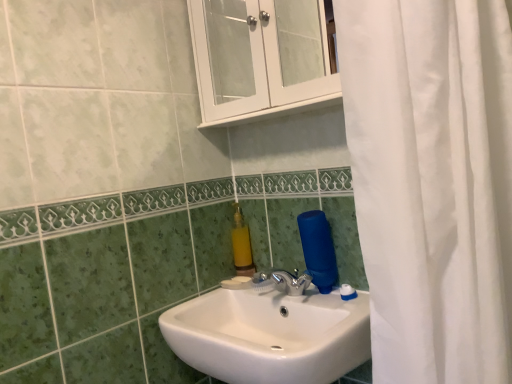
Question: Is the depth of white glossy cabinet at upper center less than that of white glossy sink at center?

Choices:
 (A) yes
 (B) no

Answer: (B)

Question: Can you confirm if white glossy cabinet at upper center is bigger than white glossy sink at center?

Choices:
 (A) no
 (B) yes

Answer: (A)

Question: Is white glossy cabinet at upper center outside white glossy sink at center?

Choices:
 (A) no
 (B) yes

Answer: (B)

Question: Does white glossy cabinet at upper center have a smaller size compared to white glossy sink at center?

Choices:
 (A) no
 (B) yes

Answer: (B)

Question: From the image's perspective, is white glossy cabinet at upper center on top of white glossy sink at center?

Choices:
 (A) yes
 (B) no

Answer: (A)

Question: Considering the positions of white glossy sink at center and yellow matte soap dispenser at upper center in the image, is white glossy sink at center wider or thinner than yellow matte soap dispenser at upper center?

Choices:
 (A) wide
 (B) thin

Answer: (A)

Question: Would you say white glossy sink at center is inside or outside yellow matte soap dispenser at upper center?

Choices:
 (A) outside
 (B) inside

Answer: (A)

Question: Considering their positions, is white glossy sink at center located in front of or behind yellow matte soap dispenser at upper center?

Choices:
 (A) front
 (B) behind

Answer: (A)

Question: In the image, is white glossy sink at center on the left side or the right side of yellow matte soap dispenser at upper center?

Choices:
 (A) left
 (B) right

Answer: (B)

Question: Is yellow matte soap dispenser at upper center bigger or smaller than white glossy sink at center?

Choices:
 (A) big
 (B) small

Answer: (B)

Question: From the image's perspective, is yellow matte soap dispenser at upper center above or below white glossy sink at center?

Choices:
 (A) below
 (B) above

Answer: (B)

Question: From a real-world perspective, is yellow matte soap dispenser at upper center physically located above or below white glossy sink at center?

Choices:
 (A) below
 (B) above

Answer: (B)

Question: Does point (251, 254) appear closer or farther from the camera than point (227, 288)?

Choices:
 (A) farther
 (B) closer

Answer: (A)

Question: Is yellow matte soap dispenser at upper center wider or thinner than white glossy cabinet at upper center?

Choices:
 (A) wide
 (B) thin

Answer: (B)

Question: From the image's perspective, is yellow matte soap dispenser at upper center above or below white glossy cabinet at upper center?

Choices:
 (A) above
 (B) below

Answer: (B)